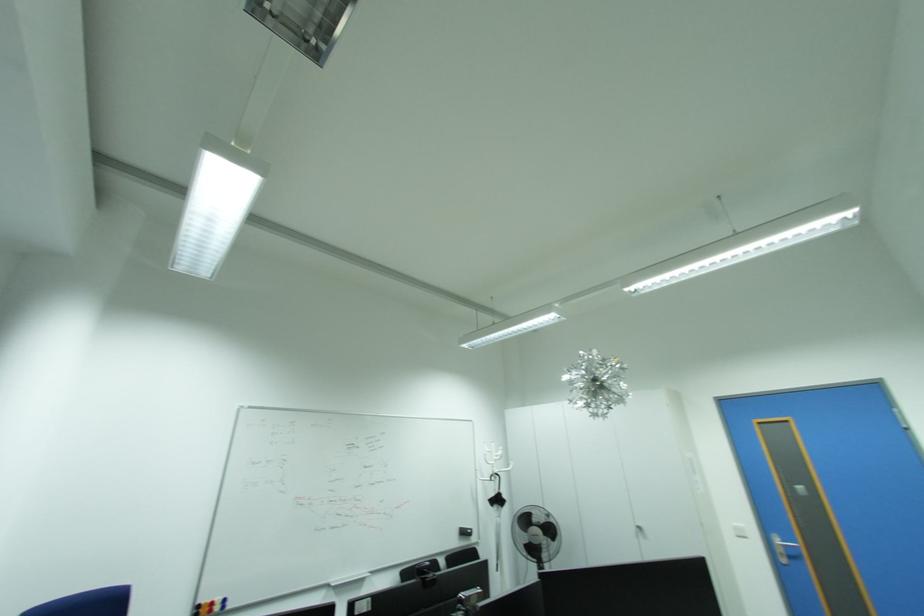
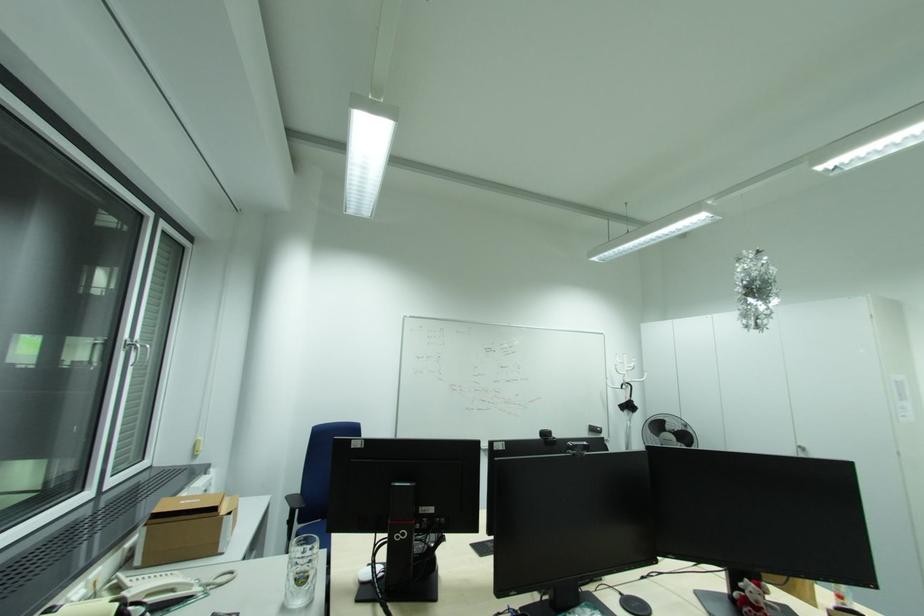
In a continuous first-person perspective shot, in which direction is the camera moving?

A: The cameraman moved toward right, backward.